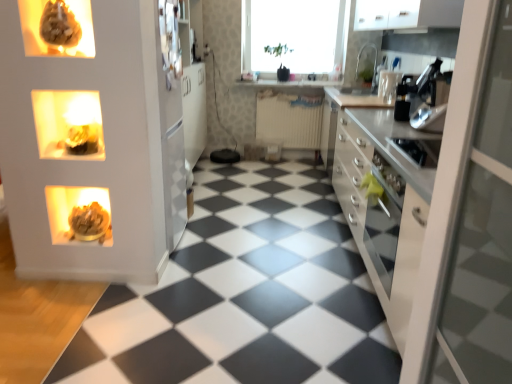
Question: Should I look upward or downward to see black rubber tile at center?

Choices:
 (A) down
 (B) up

Answer: (A)

Question: From a real-world perspective, is matte gold sculpture at left, positioned as the second appliance in front-to-back order, on satin white countertop at right?

Choices:
 (A) yes
 (B) no

Answer: (B)

Question: Is matte gold sculpture at left, the 1th appliance positioned from the bottom, shorter than satin white countertop at right?

Choices:
 (A) no
 (B) yes

Answer: (B)

Question: From a real-world perspective, is matte gold sculpture at left, marked as the 1th appliance in a left-to-right arrangement, below satin white countertop at right?

Choices:
 (A) yes
 (B) no

Answer: (A)

Question: Considering the relative positions of matte gold sculpture at left, placed as the 4th appliance when sorted from right to left, and satin white countertop at right in the image provided, is matte gold sculpture at left, placed as the 4th appliance when sorted from right to left, to the right of satin white countertop at right from the viewer's perspective?

Choices:
 (A) no
 (B) yes

Answer: (A)

Question: Is the depth of matte gold sculpture at left, positioned as the second appliance in front-to-back order, greater than that of satin white countertop at right?

Choices:
 (A) no
 (B) yes

Answer: (B)

Question: Considering the relative sizes of matte gold sculpture at left, positioned as the second appliance in front-to-back order, and satin white countertop at right in the image provided, is matte gold sculpture at left, positioned as the second appliance in front-to-back order, taller than satin white countertop at right?

Choices:
 (A) yes
 (B) no

Answer: (B)

Question: Is transparent glass window at upper center behind white glossy countertop at center?

Choices:
 (A) no
 (B) yes

Answer: (A)

Question: From the image's perspective, is transparent glass window at upper center on white glossy countertop at center?

Choices:
 (A) no
 (B) yes

Answer: (B)

Question: Can we say transparent glass window at upper center lies outside white glossy countertop at center?

Choices:
 (A) no
 (B) yes

Answer: (B)

Question: From a real-world perspective, is transparent glass window at upper center below white glossy countertop at center?

Choices:
 (A) no
 (B) yes

Answer: (A)

Question: From a real-world perspective, is transparent glass window at upper center over white glossy countertop at center?

Choices:
 (A) no
 (B) yes

Answer: (B)

Question: Can you confirm if transparent glass window at upper center is positioned to the left of white glossy countertop at center?

Choices:
 (A) yes
 (B) no

Answer: (B)

Question: Can you confirm if matte brown sculpture at upper left, placed as the 1th appliance when sorted from front to back, is bigger than matte gold sculpture at left, which appears as the 4th appliance when viewed from the top?

Choices:
 (A) no
 (B) yes

Answer: (A)